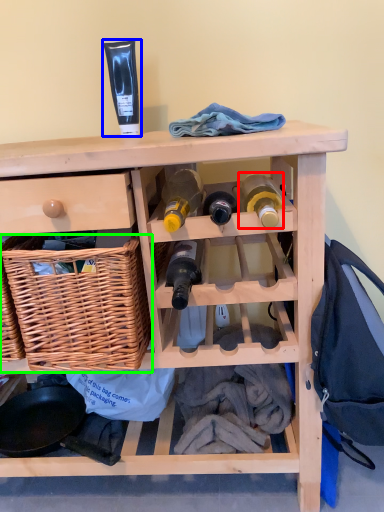
Question: Which object is positioned farthest from bottle (highlighted by a red box)? Select from toiletry (highlighted by a blue box) and basket (highlighted by a green box).

Choices:
 (A) toiletry
 (B) basket

Answer: (A)